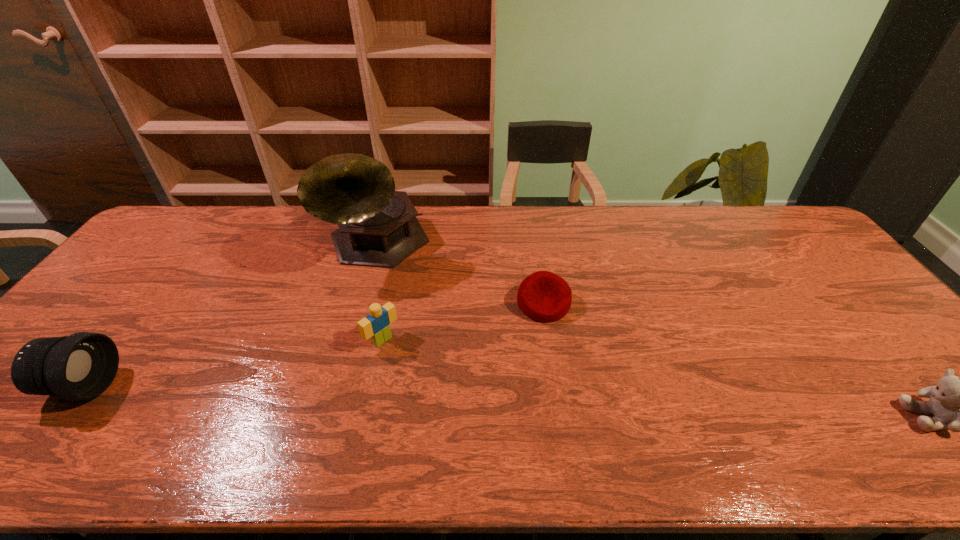
Where is `vacant space at the far edge of the desktop`? vacant space at the far edge of the desktop is located at coordinates (606, 223).

Where is `free region at the near edge of the desktop`? free region at the near edge of the desktop is located at coordinates (510, 398).

You are a GUI agent. You are given a task and a screenshot of the screen. Output one action in this format:
    pyautogui.click(x=<x>, y=<y>)
    Task: Click on the free space at the left edge of the desktop
    
    Given the screenshot: What is the action you would take?
    pyautogui.click(x=123, y=326)

The height and width of the screenshot is (540, 960). Identify the location of free space at the right edge of the desktop. [868, 319].

At what (x,y) coordinates should I click in order to perform the action: click on vacant point located between the third nearest object and the tallest object. Please return your answer as a coordinate pair (x, y). Image resolution: width=960 pixels, height=540 pixels. Looking at the image, I should click on (380, 293).

Where is `free point between the tallest object and the shortest object`? free point between the tallest object and the shortest object is located at coordinates (461, 275).

Find the location of `unoccupied position between the second tallest object and the shortest object`. unoccupied position between the second tallest object and the shortest object is located at coordinates (313, 345).

Find the location of `free space between the beanbag and the telephoto lens`. free space between the beanbag and the telephoto lens is located at coordinates pyautogui.click(x=313, y=345).

Where is `vacant space in between the phonograph record and the second object from right to left`? vacant space in between the phonograph record and the second object from right to left is located at coordinates (461, 275).

Locate an element on the screen. vacant space that's between the shortest object and the third farthest object is located at coordinates (463, 322).